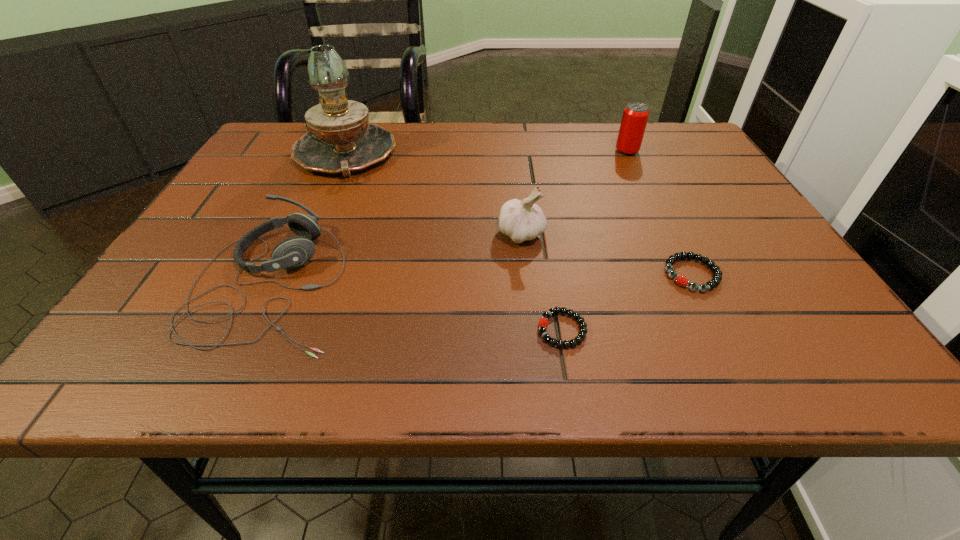
The height and width of the screenshot is (540, 960). I want to click on oil lamp, so click(341, 141).

Locate an element on the screen. The height and width of the screenshot is (540, 960). can is located at coordinates (635, 116).

At what (x,y) coordinates should I click in order to perform the action: click on garlic. Please return your answer as a coordinate pair (x, y). Image resolution: width=960 pixels, height=540 pixels. Looking at the image, I should click on (524, 220).

What are the coordinates of `the fourth tallest object` in the screenshot? It's located at (292, 252).

Locate an element on the screen. Image resolution: width=960 pixels, height=540 pixels. the fifth tallest object is located at coordinates (682, 281).

This screenshot has width=960, height=540. I want to click on the right bracelet, so click(682, 281).

Identify the location of the left bracelet. (543, 323).

Where is `the shortest object`? The height and width of the screenshot is (540, 960). the shortest object is located at coordinates (543, 323).

The height and width of the screenshot is (540, 960). In order to click on vacant space located on the right of the tallest object in this screenshot , I will do `click(490, 155)`.

Where is `free space located 0.210m on the left of the can`? The height and width of the screenshot is (540, 960). free space located 0.210m on the left of the can is located at coordinates (535, 151).